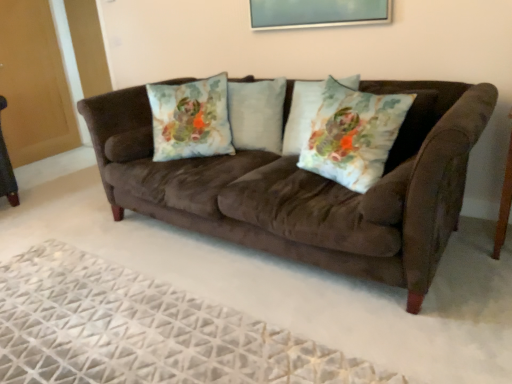
Locate an element on the screen. This screenshot has width=512, height=384. vacant space behind brown wood side table at right is located at coordinates (475, 236).